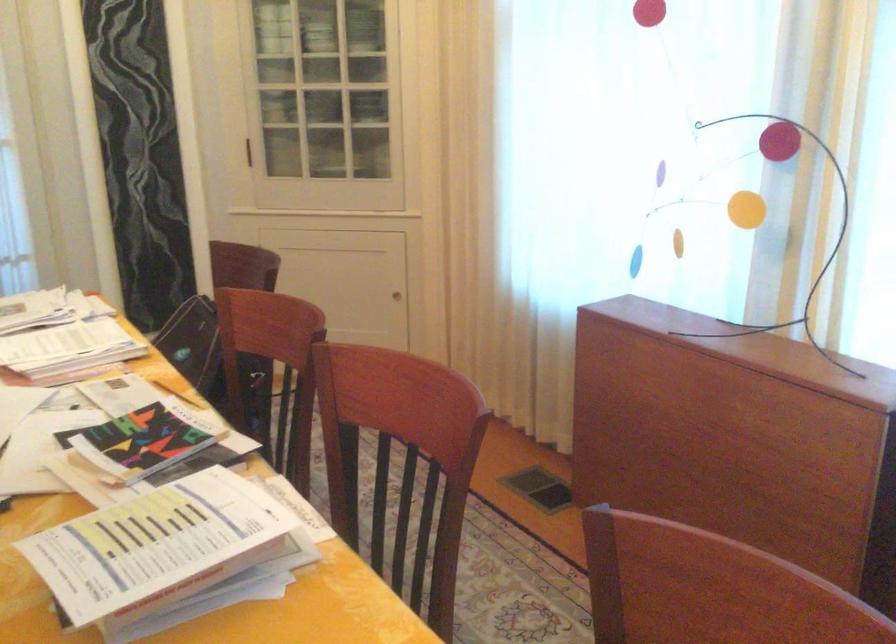
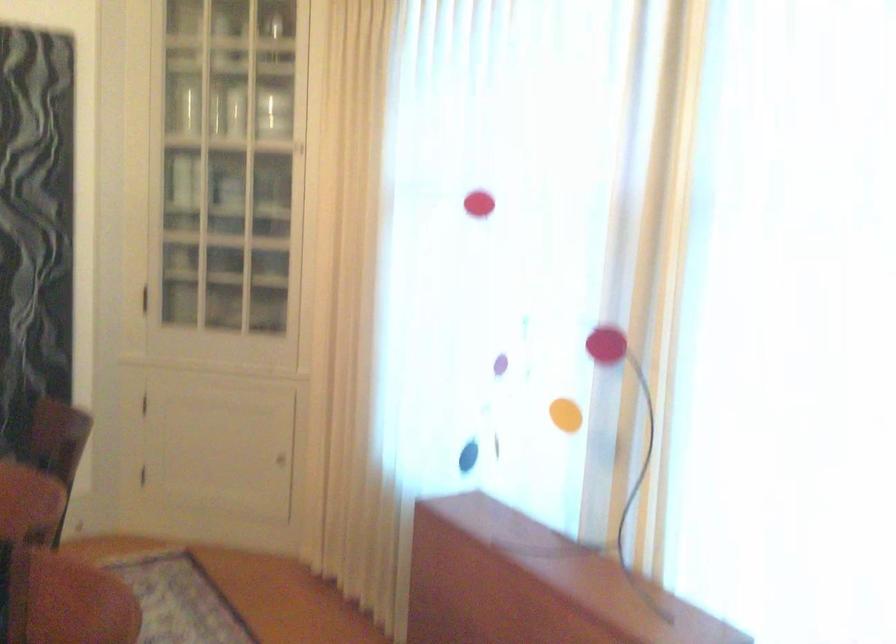
Question: Which direction would the cameraman need to move to produce the second image? Reply with the corresponding letter.

Choices:
 (A) Left
 (B) Right
 (C) Forward
 (D) Backward

Answer: (B)